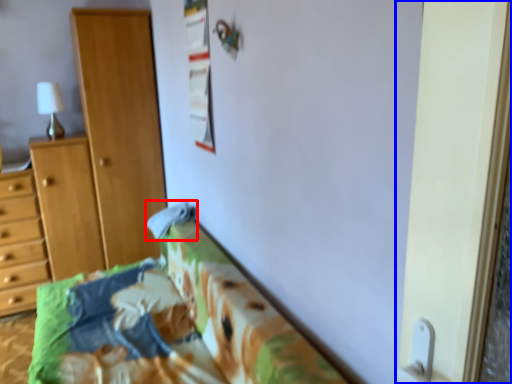
Question: Which of the following is the closest to the observer, pillow (highlighted by a red box) or screen door (highlighted by a blue box)?

Choices:
 (A) pillow
 (B) screen door

Answer: (B)